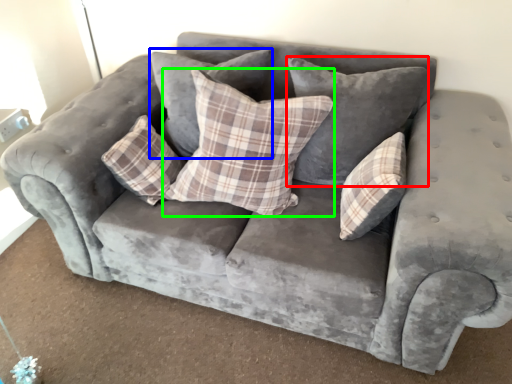
Question: Considering the real-world distances, which object is farthest from pillow (highlighted by a red box)? pillow (highlighted by a blue box) or pillow (highlighted by a green box)?

Choices:
 (A) pillow
 (B) pillow

Answer: (A)